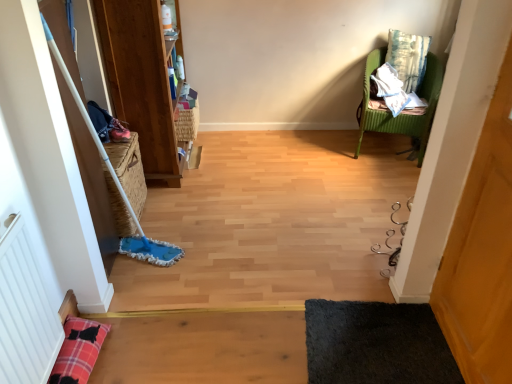
Question: From the image's perspective, is woven straw basket at left, which is the 2th basket from top to bottom, on textured blue-green pillow at upper right?

Choices:
 (A) no
 (B) yes

Answer: (A)

Question: Is woven straw basket at left, which ranks as the 1th basket in left-to-right order, at the right side of textured blue-green pillow at upper right?

Choices:
 (A) no
 (B) yes

Answer: (A)

Question: Does woven straw basket at left, which ranks as the 1th basket in left-to-right order, lie in front of textured blue-green pillow at upper right?

Choices:
 (A) no
 (B) yes

Answer: (B)

Question: Could you tell me if woven straw basket at left, which is the first basket from bottom to top, is facing textured blue-green pillow at upper right?

Choices:
 (A) no
 (B) yes

Answer: (A)

Question: Can you confirm if woven straw basket at left, which appears as the 1th basket when viewed from the front, is shorter than textured blue-green pillow at upper right?

Choices:
 (A) yes
 (B) no

Answer: (B)

Question: From their relative heights in the image, would you say textured blue-green pillow at upper right is taller or shorter than wooden bookshelf at left?

Choices:
 (A) short
 (B) tall

Answer: (A)

Question: Considering the positions of textured blue-green pillow at upper right and wooden bookshelf at left in the image, is textured blue-green pillow at upper right bigger or smaller than wooden bookshelf at left?

Choices:
 (A) small
 (B) big

Answer: (A)

Question: Is textured blue-green pillow at upper right spatially inside wooden bookshelf at left, or outside of it?

Choices:
 (A) outside
 (B) inside

Answer: (A)

Question: Does point pyautogui.click(x=394, y=39) appear closer or farther from the camera than point pyautogui.click(x=165, y=152)?

Choices:
 (A) farther
 (B) closer

Answer: (A)

Question: Is black shaggy rug at lower right wider or thinner than wooden bookshelf at left?

Choices:
 (A) thin
 (B) wide

Answer: (B)

Question: From the image's perspective, is black shaggy rug at lower right located above or below wooden bookshelf at left?

Choices:
 (A) above
 (B) below

Answer: (B)

Question: From a real-world perspective, is black shaggy rug at lower right positioned above or below wooden bookshelf at left?

Choices:
 (A) above
 (B) below

Answer: (B)

Question: Choose the correct answer: Is black shaggy rug at lower right inside wooden bookshelf at left or outside it?

Choices:
 (A) inside
 (B) outside

Answer: (B)

Question: Considering the positions of woven brown basket at upper center, positioned as the second basket in left-to-right order, and white textured radiator at lower left in the image, is woven brown basket at upper center, positioned as the second basket in left-to-right order, taller or shorter than white textured radiator at lower left?

Choices:
 (A) tall
 (B) short

Answer: (B)

Question: From a real-world perspective, is woven brown basket at upper center, positioned as the second basket in left-to-right order, physically located above or below white textured radiator at lower left?

Choices:
 (A) above
 (B) below

Answer: (B)